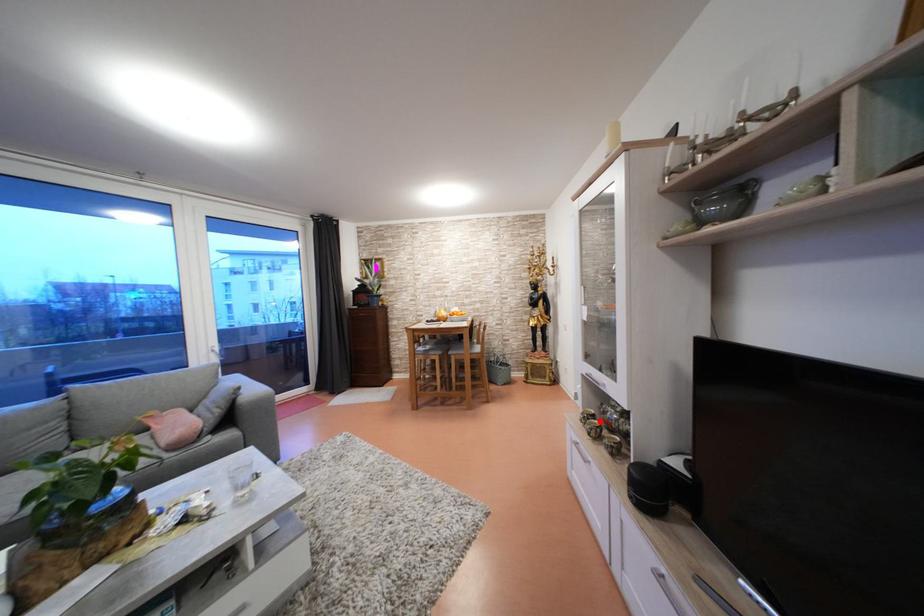
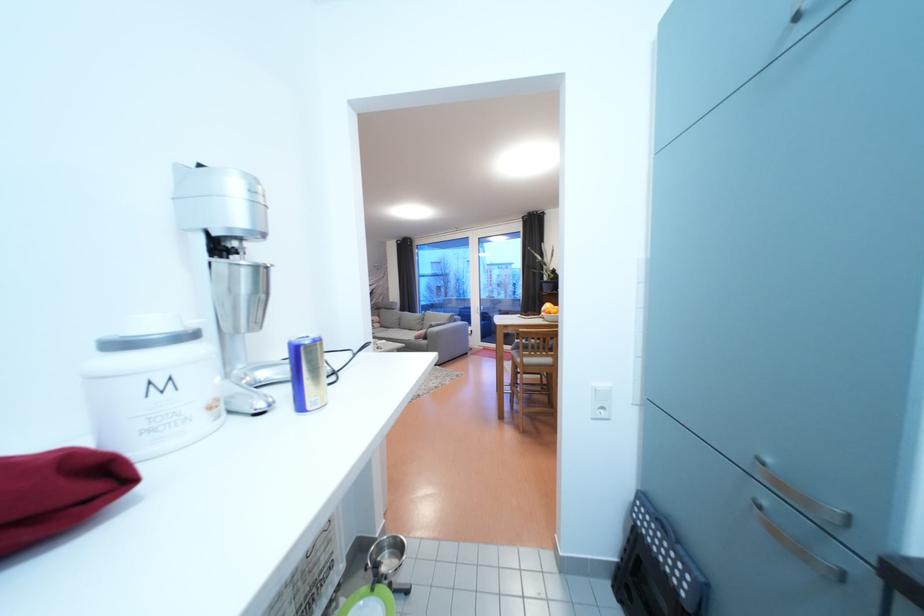
Question: I am providing you with two images of the same scene from different viewpoints. A red point is marked on the first image. Can you still see the location of the red point in image 2?

Choices:
 (A) Yes
 (B) No

Answer: (B)